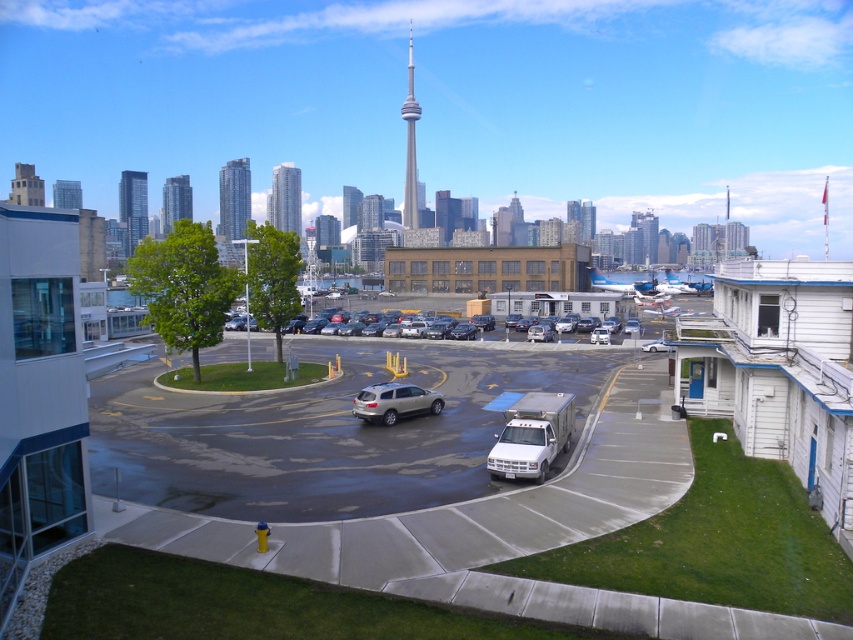
You are an architect analyzing the cityscape. You notice the silver glass skyscraper at upper left and the glassy reflective skyscraper at upper left. Which one has a greater height?

The silver glass skyscraper at upper left is taller than the glassy reflective skyscraper at upper left.